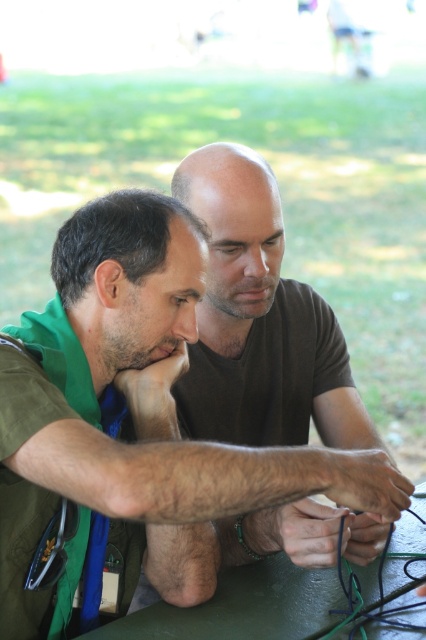
Does green fabric shirt at center appear on the right side of green matte table at center?

In fact, green fabric shirt at center is to the left of green matte table at center.

Find the location of `green fabric shirt at center`. green fabric shirt at center is located at coordinates (134, 424).

Identify the location of green fabric shirt at center. (134, 424).